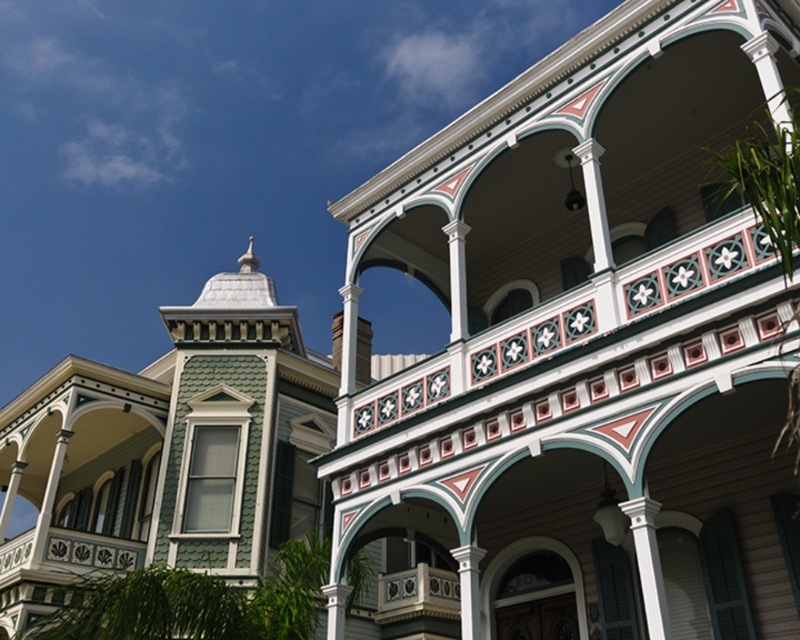
Question: Which object is closer to the camera taking this photo?

Choices:
 (A) white painted wood column at upper center
 (B) white painted wood column at center
 (C) white painted wood balcony at center

Answer: (B)

Question: Which point is farther to the camera?

Choices:
 (A) white painted wood column at center
 (B) white painted wood column at upper center

Answer: (B)

Question: Can you confirm if white painted wood column at center is positioned to the right of white painted wood column at upper center?

Choices:
 (A) no
 (B) yes

Answer: (B)

Question: Observing the image, what is the correct spatial positioning of white painted wood balcony at center in reference to white painted wood column at center?

Choices:
 (A) right
 (B) left

Answer: (B)

Question: Does white painted wood balcony at center have a lesser width compared to white painted wood column at upper center?

Choices:
 (A) yes
 (B) no

Answer: (B)

Question: Which object is the closest to the white painted wood column at center?

Choices:
 (A) white painted wood column at upper center
 (B) white painted wood balcony at center

Answer: (A)